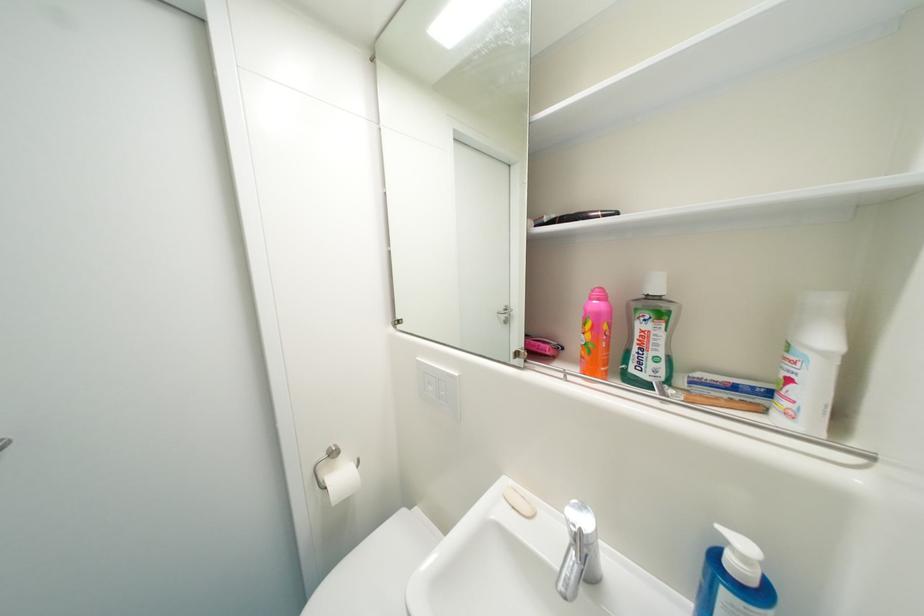
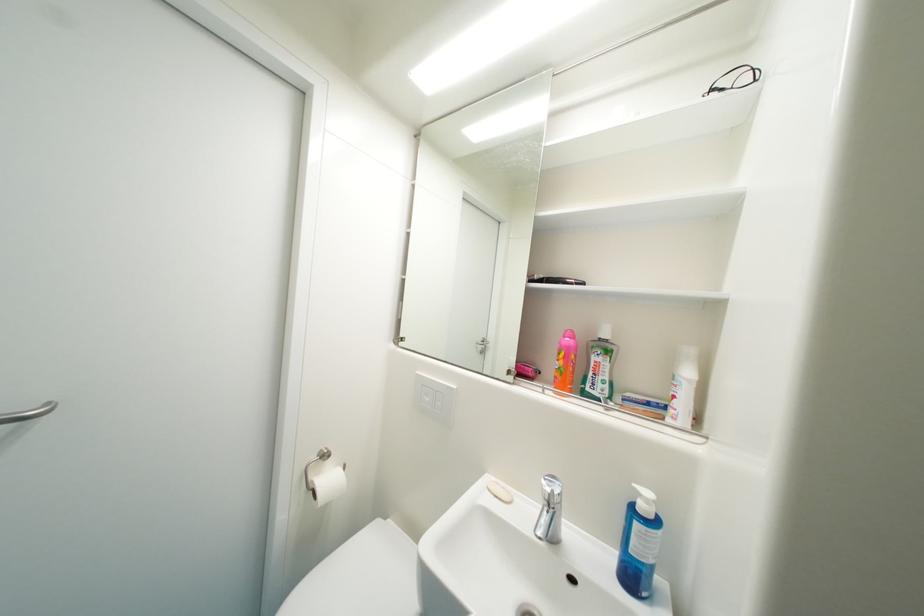
Locate, in the second image, the point that corresponds to [349,479] in the first image.

(337, 482)